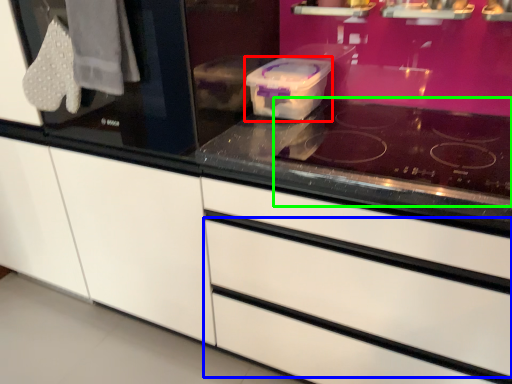
Question: Based on their relative distances, which object is nearer to appliance (highlighted by a red box)? Choose from drawer (highlighted by a blue box) and gas stove (highlighted by a green box).

Choices:
 (A) drawer
 (B) gas stove

Answer: (B)